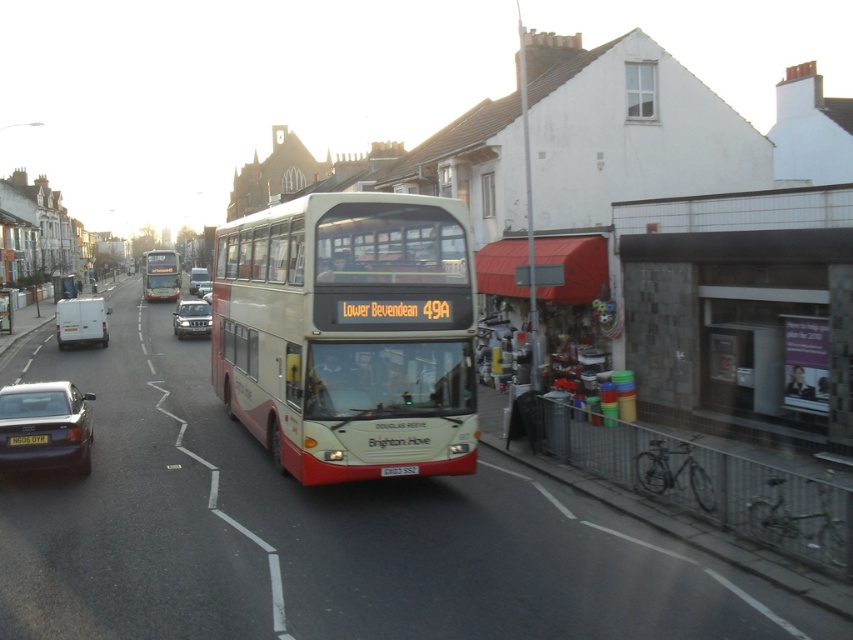
You are a pedestrian standing at the curb and want to cross the street. There is a matte red bus at center and a metallic silver car at center. Which vehicle is closer to you?

The matte red bus at center is closer to the viewer than the metallic silver car at center, so the matte red bus at center is closer to you.

You are a delivery person who needs to load a package onto a truck. You see the matte black car at lower left and the metallic silver suv at center. Which vehicle should you choose based on their heights?

The metallic silver suv at center is taller than the matte black car at lower left, so you should choose the metallic silver suv at center for loading the package because it likely has a higher clearance or larger cargo space.

You are a pedestrian standing on the sidewalk and want to cross the street. There is a matte red bus at center and a metallic silver car at center in the road. Which vehicle will you need to wait for more time to pass safely?

The matte red bus at center has a larger width than the metallic silver car at center, so it will take more time to pass safely.